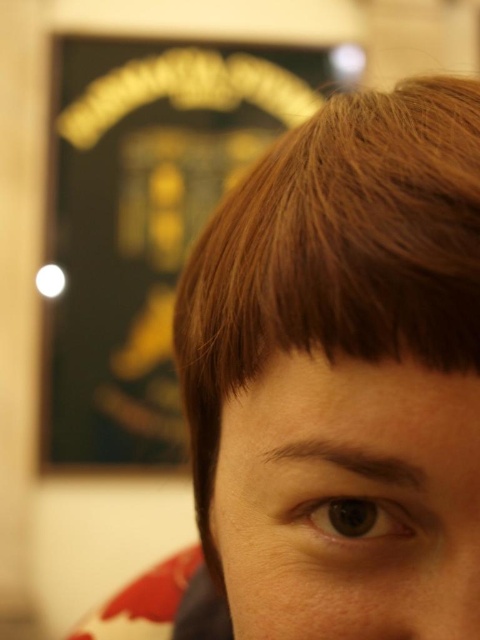
Looking at this image, can you confirm if brown matte hair at upper right is shorter than gold metallic sign at upper center?

Correct, brown matte hair at upper right is not as tall as gold metallic sign at upper center.

Who is positioned more to the right, brown matte hair at upper right or gold metallic sign at upper center?

brown matte hair at upper right

Where is `brown matte hair at upper right`? This screenshot has width=480, height=640. brown matte hair at upper right is located at coordinates (343, 372).

Who is taller, brown matte hair at upper right or smooth skin eye at center?

brown matte hair at upper right

Image resolution: width=480 pixels, height=640 pixels. Describe the element at coordinates (343, 372) in the screenshot. I see `brown matte hair at upper right` at that location.

You are a GUI agent. You are given a task and a screenshot of the screen. Output one action in this format:
    pyautogui.click(x=<x>, y=<y>)
    Task: Click on the brown matte hair at upper right
    
    Given the screenshot: What is the action you would take?
    tap(343, 372)

Does gold metallic sign at upper center have a smaller size compared to smooth skin eye at center?

Incorrect, gold metallic sign at upper center is not smaller in size than smooth skin eye at center.

Is gold metallic sign at upper center further to the viewer compared to smooth skin eye at center?

That is True.

The height and width of the screenshot is (640, 480). In order to click on gold metallic sign at upper center in this screenshot , I will do `click(145, 220)`.